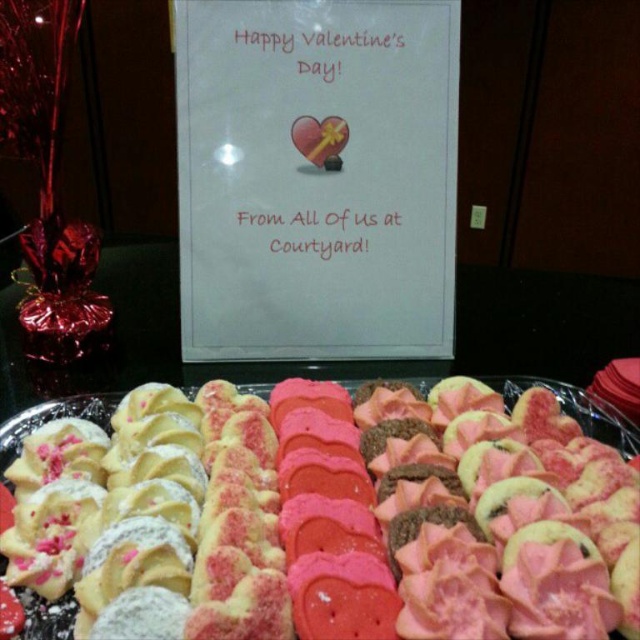
Looking at this image, you are holding a camera that needs to be positioned exactly 24 inches away from the white paper sign at upper center to capture a clear photo. Based on the scene description, is the camera currently positioned at the correct distance?

The white paper sign at upper center and camera are 24.17 inches apart, which is slightly more than 24 inches. Therefore, the camera is positioned slightly farther than the required distance.